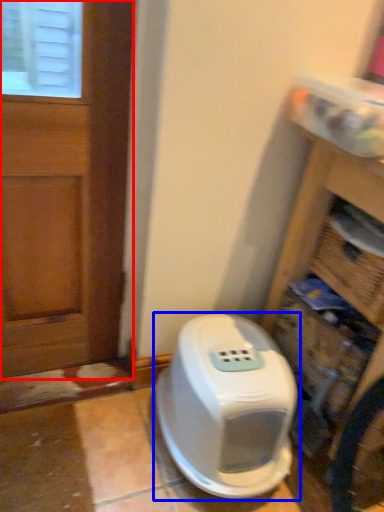
Question: Which of the following is the closest to the observer, door (highlighted by a red box) or home appliance (highlighted by a blue box)?

Choices:
 (A) door
 (B) home appliance

Answer: (A)